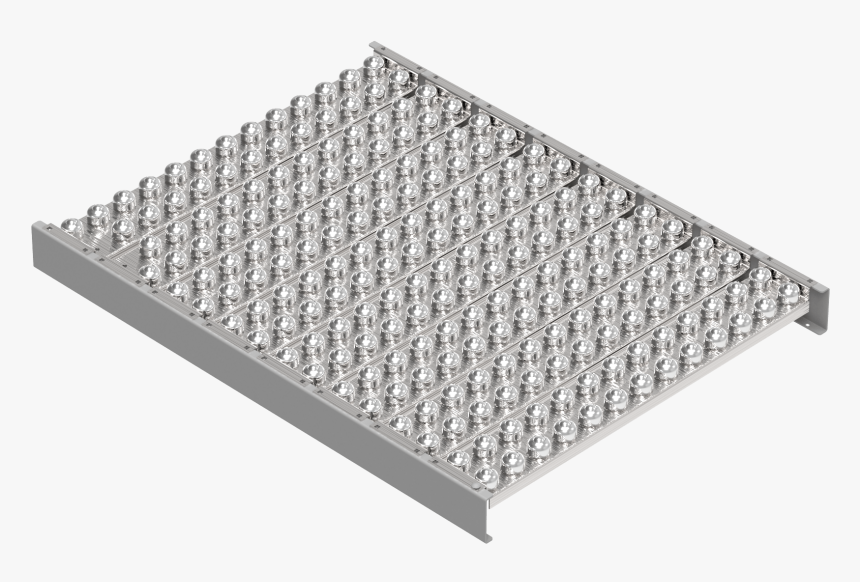
This screenshot has height=582, width=860. What are the coordinates of `lamp` in the screenshot? It's located at (197, 521), (467, 311).